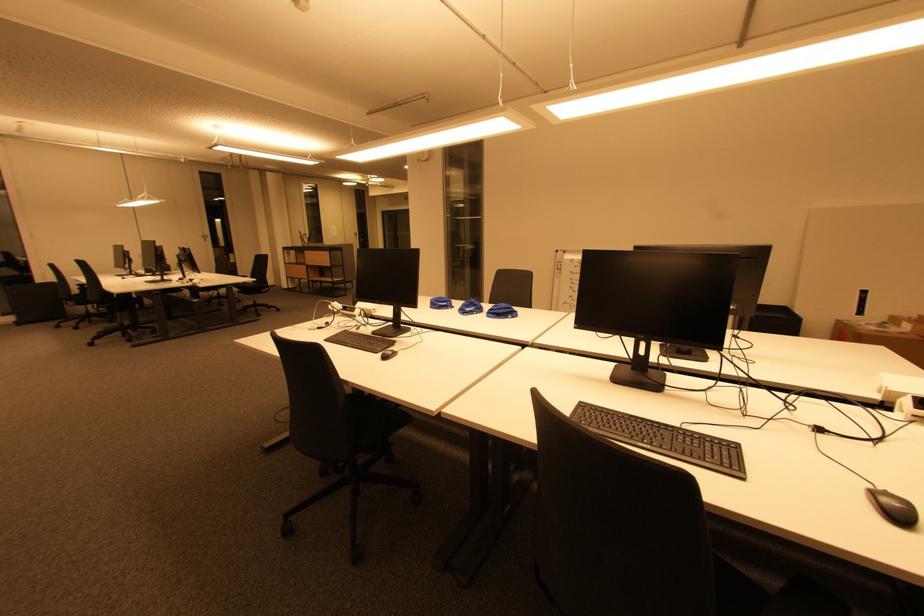
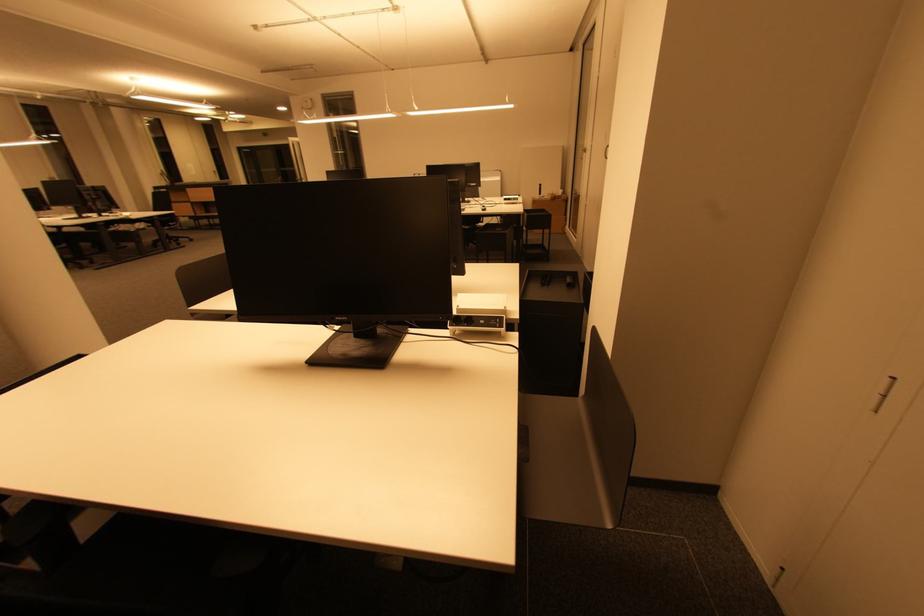
Question: What movement of the cameraman would produce the second image?

Choices:
 (A) Left
 (B) Right
 (C) Forward
 (D) Backward

Answer: (D)